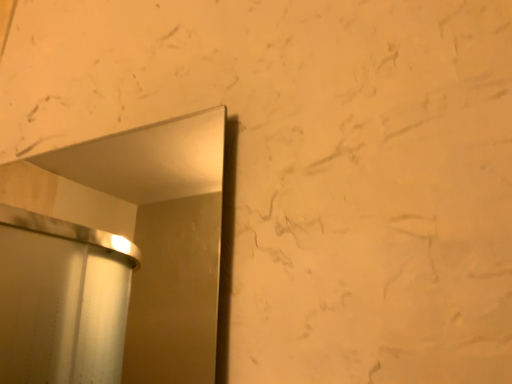
I want to click on metallic silver mirror at upper left, so click(114, 258).

Image resolution: width=512 pixels, height=384 pixels. What do you see at coordinates (114, 258) in the screenshot?
I see `metallic silver mirror at upper left` at bounding box center [114, 258].

What is the approximate height of metallic silver mirror at upper left?

The height of metallic silver mirror at upper left is 14.15 inches.

I want to click on metallic silver mirror at upper left, so click(x=114, y=258).